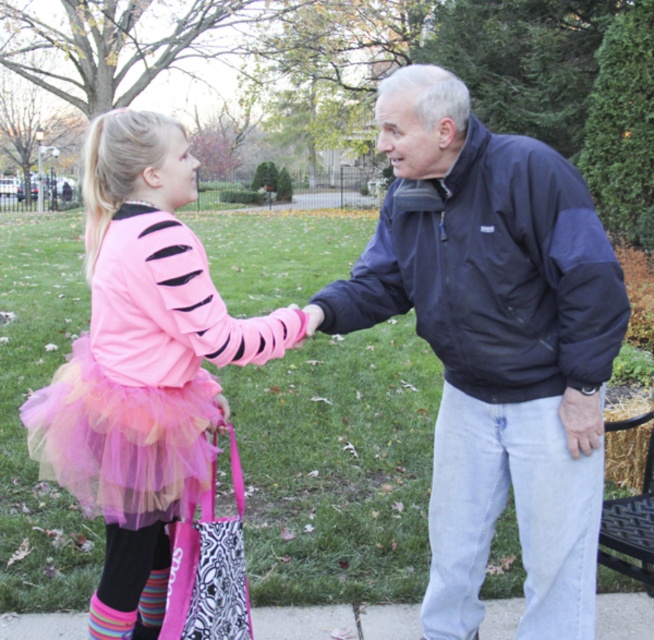
Is pink tulle ballet skirt at lower left positioned at the back of striped wool sock at lower left?

That is False.

Which of these two, pink tulle ballet skirt at lower left or striped wool sock at lower left, stands shorter?

striped wool sock at lower left is shorter.

What do you see at coordinates (122, 440) in the screenshot?
I see `pink tulle ballet skirt at lower left` at bounding box center [122, 440].

This screenshot has height=640, width=654. Find the location of `pink tulle ballet skirt at lower left`. pink tulle ballet skirt at lower left is located at coordinates (122, 440).

Does point (190, 305) come closer to viewer compared to point (186, 481)?

Yes, it is in front of point (186, 481).

Which is above, pink tulle skirt at left or pink tulle ballet skirt at lower left?

Positioned higher is pink tulle ballet skirt at lower left.

Is point (175, 496) less distant than point (120, 397)?

No.

Identify the location of pink tulle skirt at left. (143, 356).

Is navy blue jacket at center shorter than pink tulle skirt at left?

In fact, navy blue jacket at center may be taller than pink tulle skirt at left.

From the picture: Is navy blue jacket at center behind pink tulle skirt at left?

No, navy blue jacket at center is in front of pink tulle skirt at left.

Locate an element on the screen. The width and height of the screenshot is (654, 640). navy blue jacket at center is located at coordinates (494, 344).